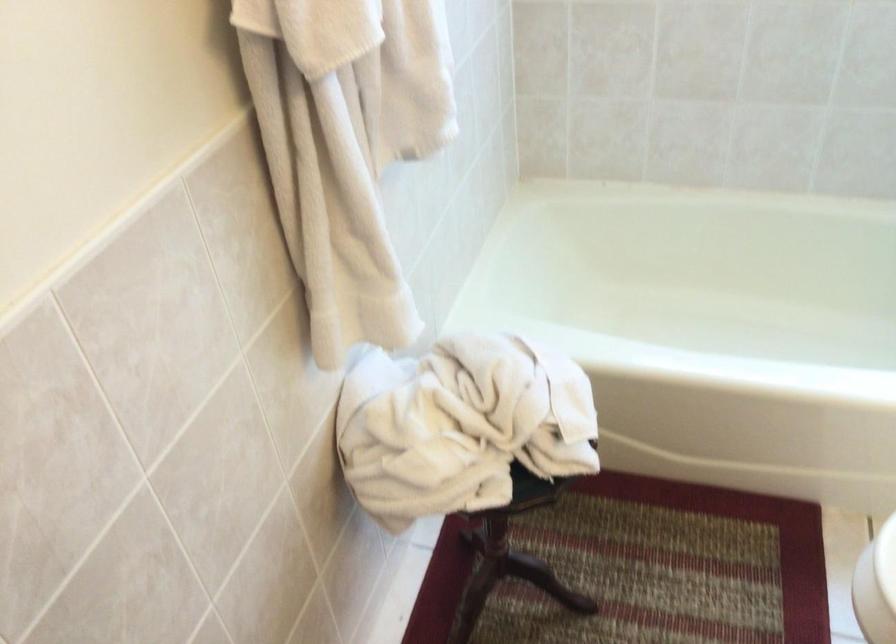
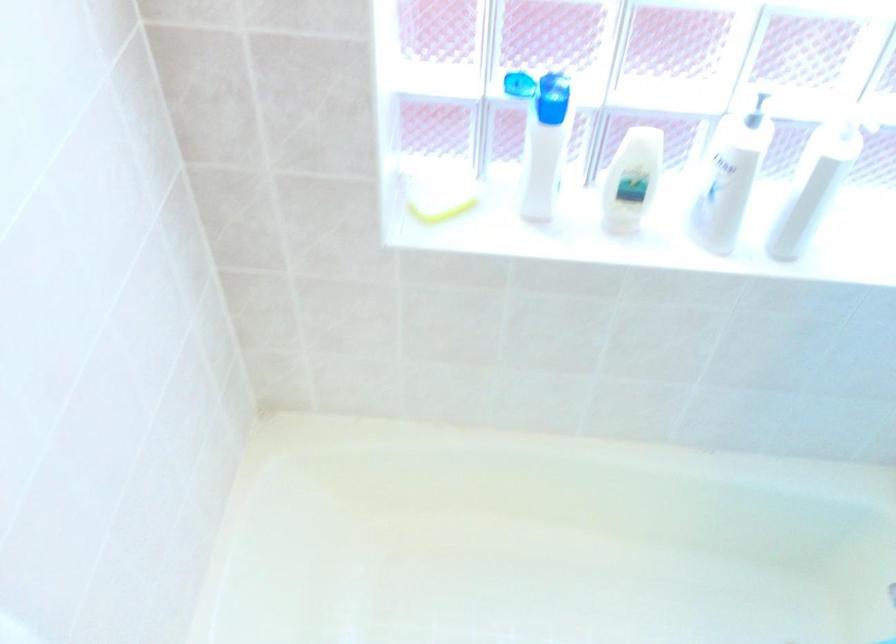
Question: How did the camera likely rotate?

Choices:
 (A) Left
 (B) Right
 (C) Up
 (D) Down

Answer: (B)